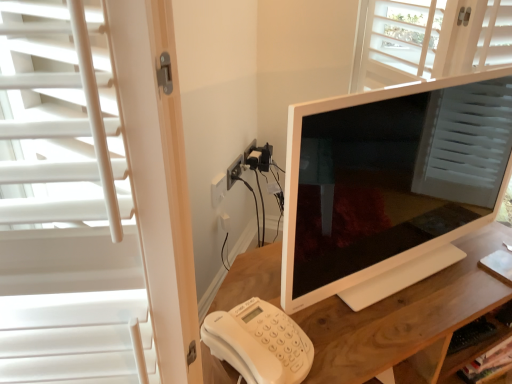
You are a GUI agent. You are given a task and a screenshot of the screen. Output one action in this format:
    pyautogui.click(x=<x>, y=<y>)
    Task: Click on the free location in front of white glossy monitor at center
    This screenshot has height=384, width=512.
    Given the screenshot: What is the action you would take?
    click(400, 314)